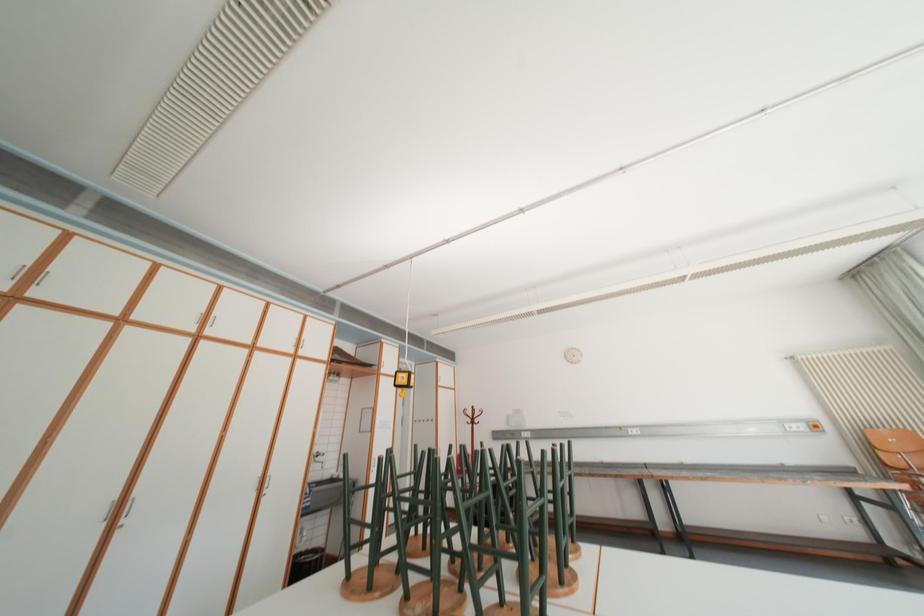
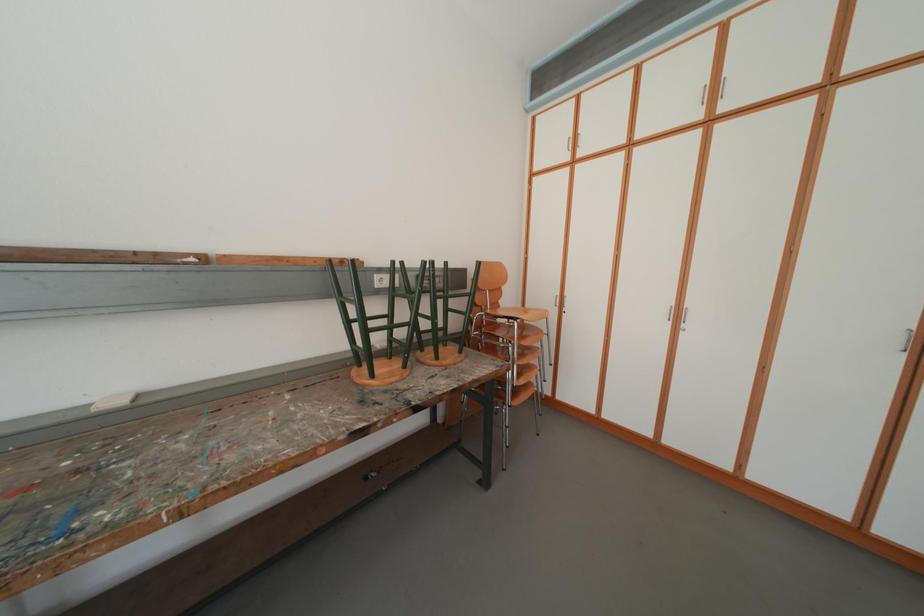
Question: How did the camera likely rotate?

Choices:
 (A) Left
 (B) Right
 (C) Up
 (D) Down

Answer: (A)